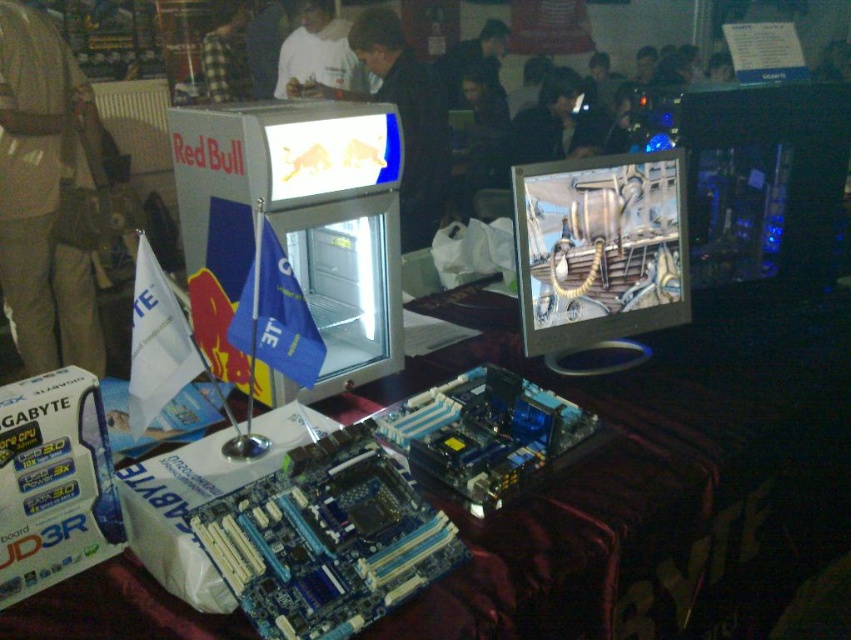
Question: Which of the following is the closest to the observer?

Choices:
 (A) (655, 355)
 (B) (530, 188)

Answer: (B)

Question: Is matte black monitor at center below checkered fabric shirt at upper center?

Choices:
 (A) yes
 (B) no

Answer: (A)

Question: Is the position of shiny blue motherboard at center more distant than that of tan fabric bag at center?

Choices:
 (A) no
 (B) yes

Answer: (A)

Question: Which object appears farthest from the camera in this image?

Choices:
 (A) tan fabric bag at center
 (B) metallic silver monitor at center

Answer: (A)

Question: Can you confirm if matte black monitor at center is wider than tan fabric bag at center?

Choices:
 (A) yes
 (B) no

Answer: (A)

Question: Considering the real-world distances, which object is farthest from the matte black monitor at center?

Choices:
 (A) shiny blue motherboard at center
 (B) tan fabric bag at center

Answer: (B)